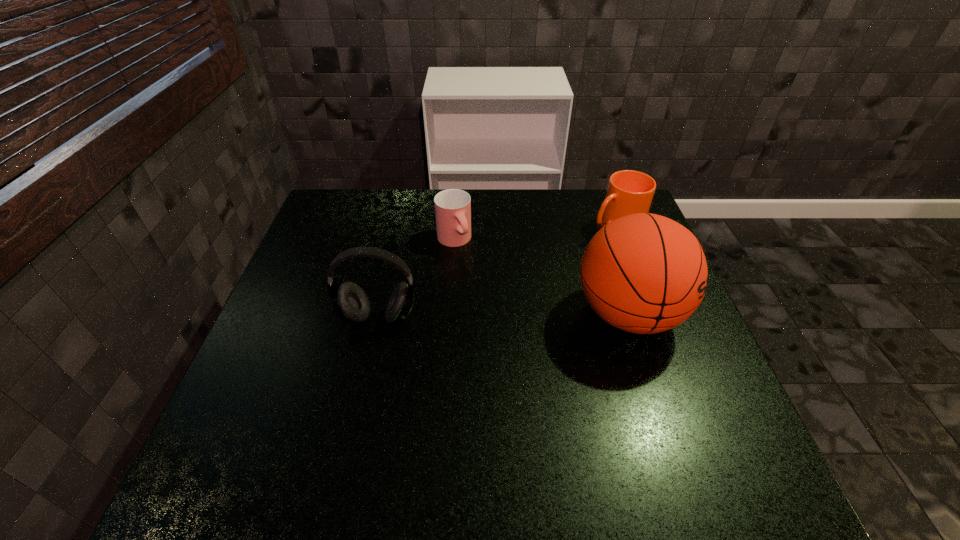
Image resolution: width=960 pixels, height=540 pixels. I want to click on vacant area situated 0.100m on the handle side of the mug, so click(575, 250).

Locate an element on the screen. The height and width of the screenshot is (540, 960). free spot located on the handle side of the mug is located at coordinates (585, 245).

Identify the location of vacant space positioned on the handle side of the mug. (500, 295).

You are a GUI agent. You are given a task and a screenshot of the screen. Output one action in this format:
    pyautogui.click(x=<x>, y=<y>)
    Task: Click on the cup located in the far edge section of the desktop
    
    Given the screenshot: What is the action you would take?
    point(452,206)

Find the location of a particular element. The height and width of the screenshot is (540, 960). mug that is at the far edge is located at coordinates (629, 192).

Identify the location of basketball situated at the right edge. This screenshot has height=540, width=960. (643, 273).

Find the location of `mug that is at the right edge`. mug that is at the right edge is located at coordinates (629, 192).

At what (x,y) coordinates should I click in order to perform the action: click on object at the far right corner. Please return your answer as a coordinate pair (x, y). Looking at the image, I should click on (629, 192).

You are a GUI agent. You are given a task and a screenshot of the screen. Output one action in this format:
    pyautogui.click(x=<x>, y=<y>)
    Task: Click on the free region at the near edge
    Image resolution: width=960 pixels, height=540 pixels.
    Given the screenshot: What is the action you would take?
    pyautogui.click(x=351, y=403)

This screenshot has width=960, height=540. In the image, there is a desktop. In order to click on free region at the left edge in this screenshot , I will do `click(356, 240)`.